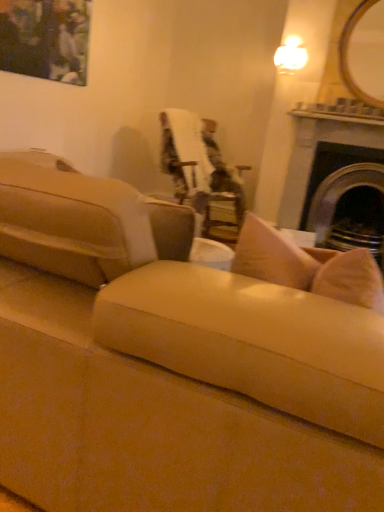
Question: Does velvet upholstered chair at center have a lesser width compared to dark gray stone fireplace at right?

Choices:
 (A) yes
 (B) no

Answer: (B)

Question: Considering the relative sizes of velvet upholstered chair at center and dark gray stone fireplace at right in the image provided, is velvet upholstered chair at center smaller than dark gray stone fireplace at right?

Choices:
 (A) no
 (B) yes

Answer: (A)

Question: From a real-world perspective, does velvet upholstered chair at center stand above dark gray stone fireplace at right?

Choices:
 (A) no
 (B) yes

Answer: (A)

Question: Considering the relative positions of velvet upholstered chair at center and dark gray stone fireplace at right in the image provided, is velvet upholstered chair at center to the right of dark gray stone fireplace at right from the viewer's perspective?

Choices:
 (A) yes
 (B) no

Answer: (B)

Question: Could you tell me if velvet upholstered chair at center is facing dark gray stone fireplace at right?

Choices:
 (A) no
 (B) yes

Answer: (A)

Question: Can you confirm if velvet upholstered chair at center is shorter than dark gray stone fireplace at right?

Choices:
 (A) no
 (B) yes

Answer: (B)

Question: Does suede beige couch at center, which is the second studio couch in left-to-right order, have a lesser width compared to dark gray stone fireplace at right?

Choices:
 (A) yes
 (B) no

Answer: (A)

Question: From the image's perspective, does suede beige couch at center, which is the second studio couch in left-to-right order, appear higher than dark gray stone fireplace at right?

Choices:
 (A) no
 (B) yes

Answer: (A)

Question: Is suede beige couch at center, which is the second studio couch in left-to-right order, surrounding dark gray stone fireplace at right?

Choices:
 (A) no
 (B) yes

Answer: (A)

Question: Is suede beige couch at center, which is the second studio couch in left-to-right order, at the left side of dark gray stone fireplace at right?

Choices:
 (A) yes
 (B) no

Answer: (A)

Question: From a real-world perspective, is suede beige couch at center, which is the second studio couch in left-to-right order, beneath dark gray stone fireplace at right?

Choices:
 (A) yes
 (B) no

Answer: (B)

Question: From a real-world perspective, is suede beige couch at center, the 1th studio couch positioned from the right, located higher than dark gray stone fireplace at right?

Choices:
 (A) yes
 (B) no

Answer: (A)

Question: Is matte black painting at upper left positioned before suede beige couch at center, the 2th studio couch from the right?

Choices:
 (A) yes
 (B) no

Answer: (B)